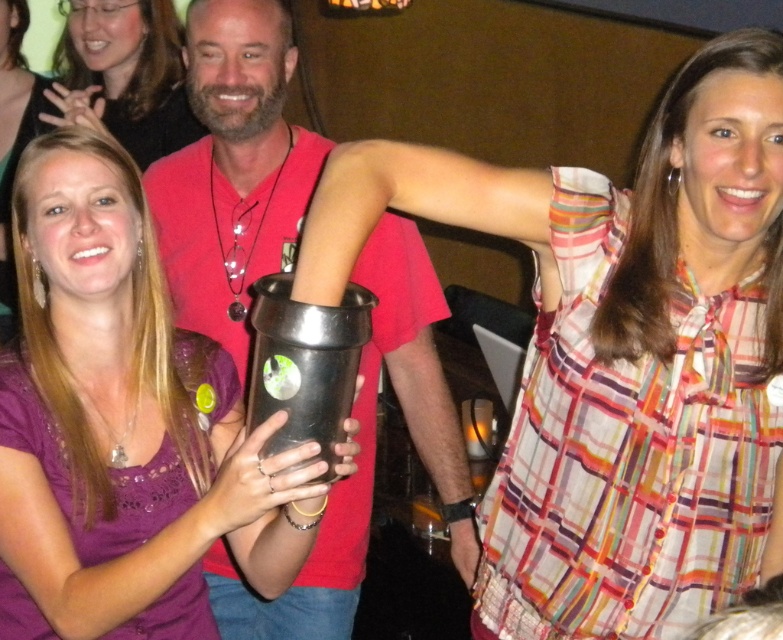
You are taking a photo of the two points in the image. Which point, point (224, 90) or point (189, 115), will appear larger in the photo?

Point (224, 90) will appear larger in the photo because it is closer to the camera than point (189, 115).

You are taking a photo of two points in the image. The first point is at coordinate point (74, 276) and the second is at point (78, 61). Which point will appear larger in your photo?

Point (74, 276) is closer to the camera than point (78, 61), so it will appear larger in the photo.